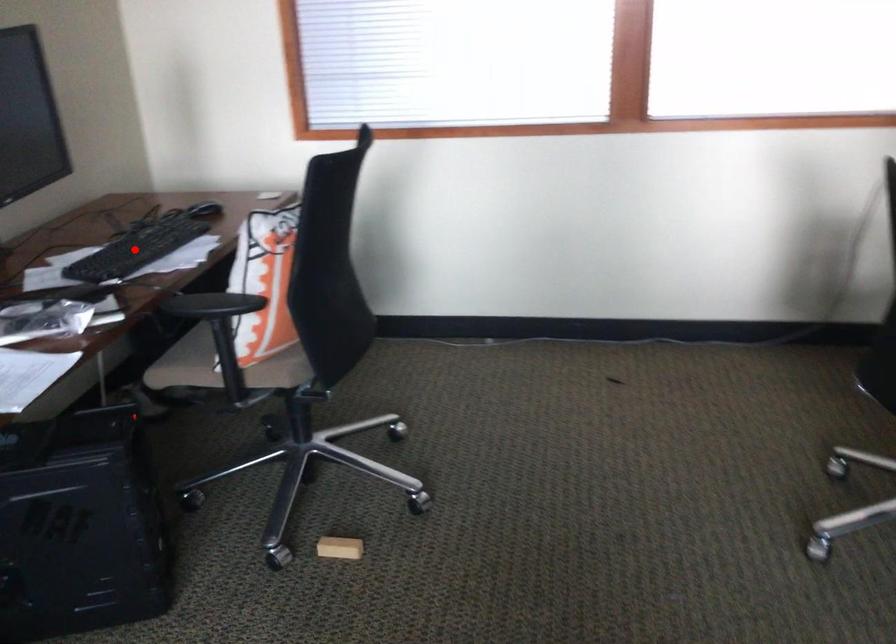
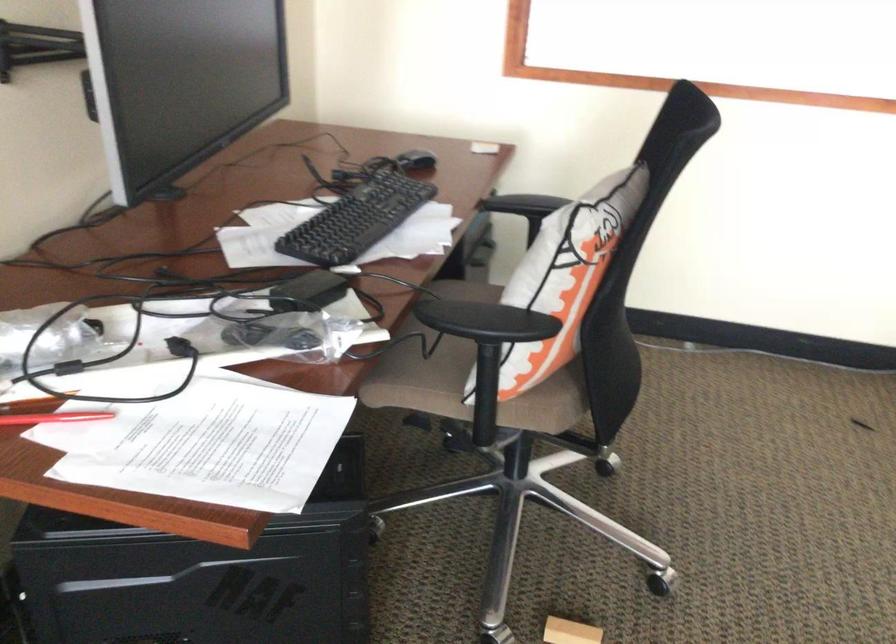
Where in the second image is the point corresponding to the highlighted location from the first image?

(356, 220)